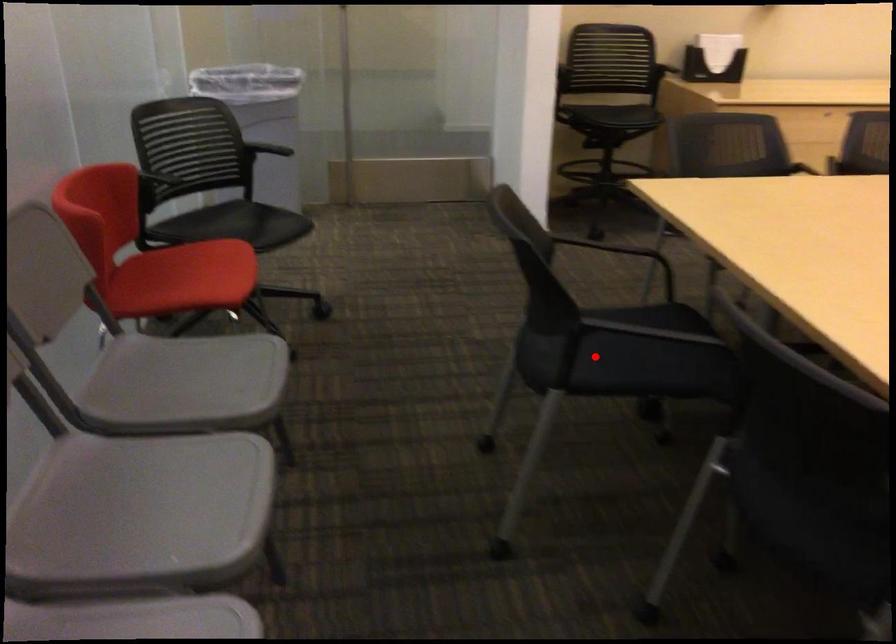
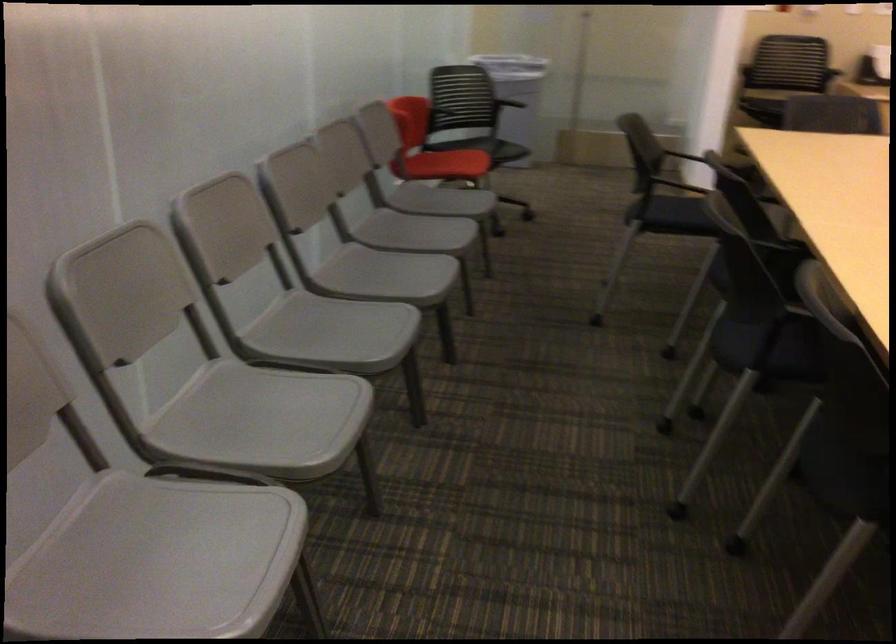
Question: I am providing you with two images of the same scene from different viewpoints. A red point is marked on the first image. Is the red point's position out of view in image 2?

Choices:
 (A) Yes
 (B) No

Answer: (B)